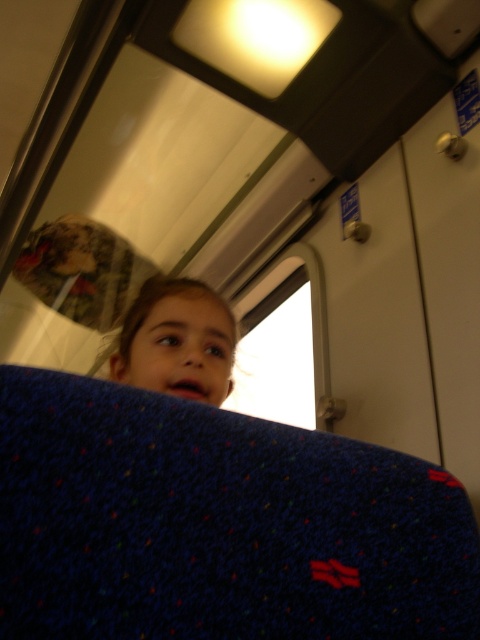
Is transparent glass window at upper center further to camera compared to matte blue fabric at upper center?

That is True.

Between point (257, 307) and point (167, 276), which one is positioned in front?

Point (167, 276) is in front.

The image size is (480, 640). In order to click on transparent glass window at upper center in this screenshot , I will do `click(280, 346)`.